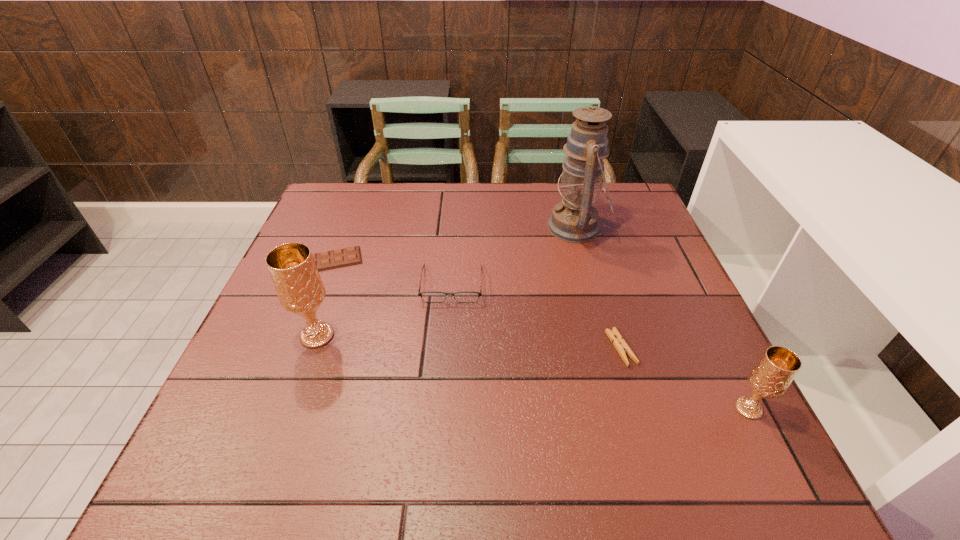
Image resolution: width=960 pixels, height=540 pixels. What are the coordinates of `free space that satisfies the following two spatial constraints: 1. on the back side of the fifth shortest object; 2. on the right side of the tallest object` in the screenshot? It's located at (356, 227).

At what (x,y) coordinates should I click in order to perform the action: click on vacant space that satisfies the following two spatial constraints: 1. on the front-facing side of the fourth object from right to left; 2. on the left side of the third tallest object. Please return your answer as a coordinate pair (x, y). This screenshot has height=540, width=960. Looking at the image, I should click on (443, 409).

Locate an element on the screen. This screenshot has width=960, height=540. free region that satisfies the following two spatial constraints: 1. on the front-facing side of the fourth tallest object; 2. on the left side of the shorter chalice is located at coordinates (443, 409).